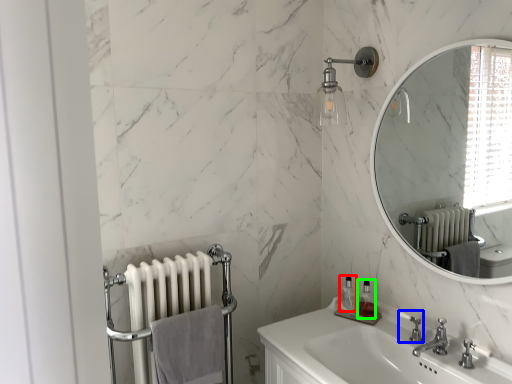
Question: Based on their relative distances, which object is farther from soap dispenser (highlighted by a red box)? Choose from plumbing fixture (highlighted by a blue box) and soap dispenser (highlighted by a green box).

Choices:
 (A) plumbing fixture
 (B) soap dispenser

Answer: (A)